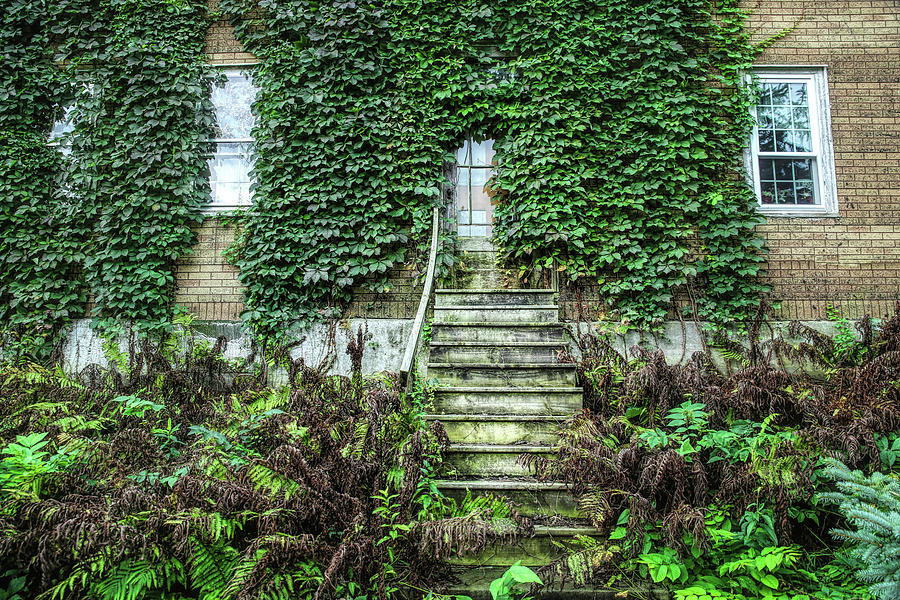
The image size is (900, 600). Find the location of `white window frame`. white window frame is located at coordinates (815, 143).